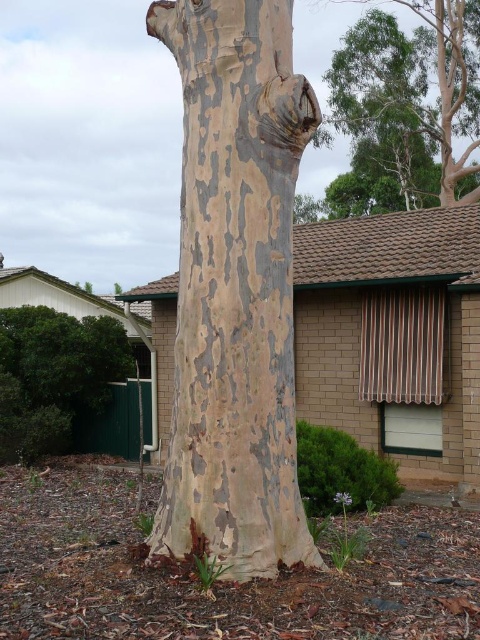
Question: Is the position of speckled bark tree trunk at center more distant than that of green leafy bush at lower left?

Choices:
 (A) no
 (B) yes

Answer: (A)

Question: Which of the following is the farthest from the observer?

Choices:
 (A) (444, 58)
 (B) (97, 369)
 (C) (191, 172)

Answer: (A)

Question: Is speckled bark tree trunk at center below smooth bark tree at upper right?

Choices:
 (A) yes
 (B) no

Answer: (A)

Question: Which object is farther from the camera taking this photo?

Choices:
 (A) green leafy bush at lower left
 (B) smooth bark tree at upper right
 (C) speckled bark tree trunk at center

Answer: (B)

Question: Which point appears farthest from the camera in this image?

Choices:
 (A) (7, 374)
 (B) (389, 205)
 (C) (231, 550)

Answer: (B)

Question: Observing the image, what is the correct spatial positioning of speckled bark tree trunk at center in reference to smooth bark tree at upper right?

Choices:
 (A) below
 (B) above

Answer: (A)